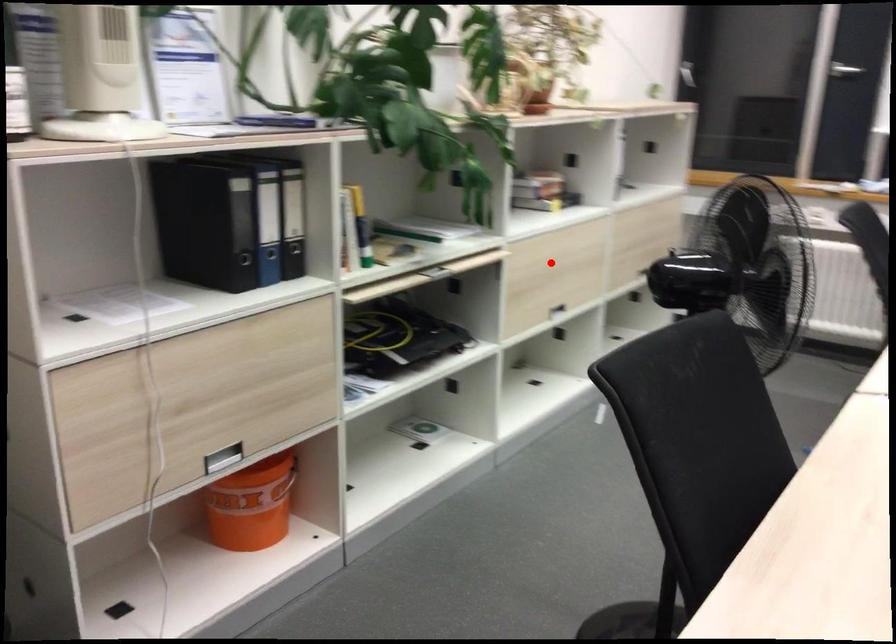
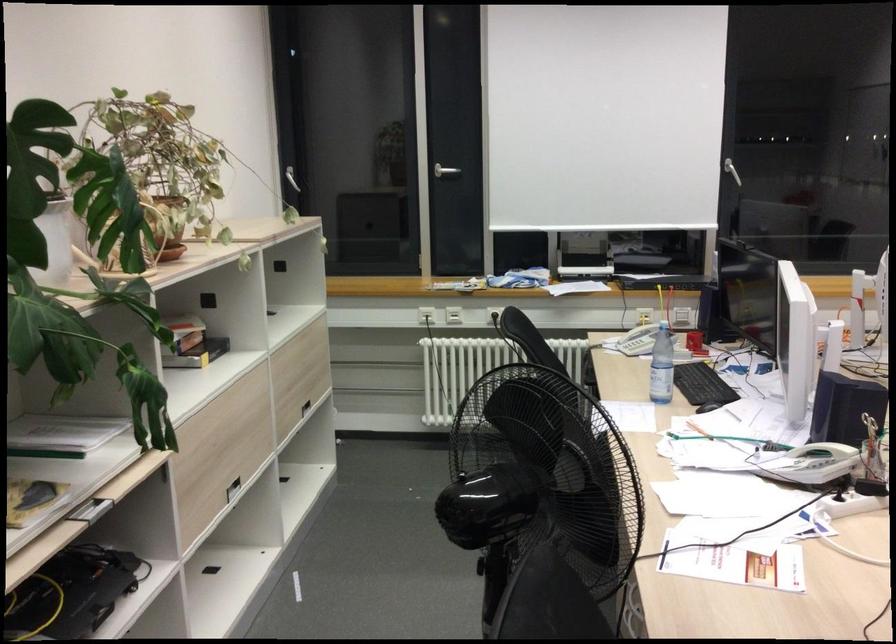
Question: A red point is marked in image1. In image2, is the corresponding 3D point closer to the camera or farther? Reply with the corresponding letter.

Choices:
 (A) The corresponding 3D point is closer.
 (B) The corresponding 3D point is farther.

Answer: (A)